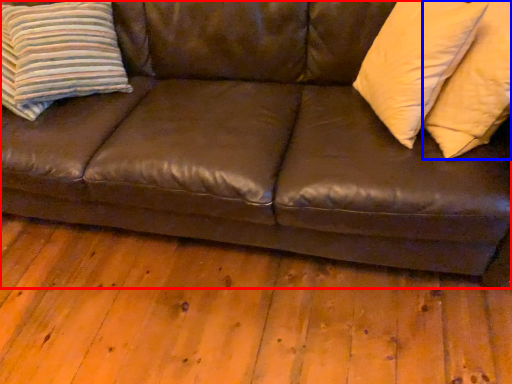
Question: Among these objects, which one is nearest to the camera, studio couch (highlighted by a red box) or pillow (highlighted by a blue box)?

Choices:
 (A) studio couch
 (B) pillow

Answer: (A)